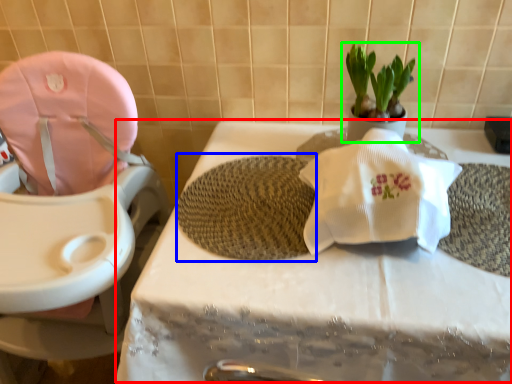
Question: Which object is the closest to the table (highlighted by a red box)? Choose among these: bath mat (highlighted by a blue box) or houseplant (highlighted by a green box).

Choices:
 (A) bath mat
 (B) houseplant

Answer: (A)